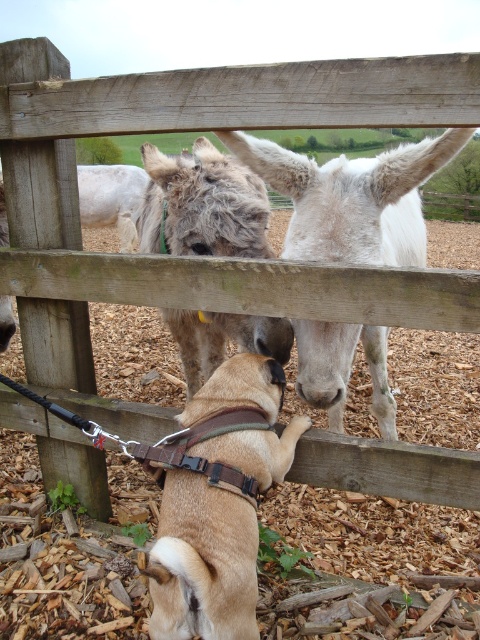
In the scene shown: Is brown leather harness at lower center closer to the viewer compared to fuzzy gray mule at center?

Yes.

Is brown leather harness at lower center to the left of fuzzy gray mule at center from the viewer's perspective?

No, brown leather harness at lower center is not to the left of fuzzy gray mule at center.

Does point (224, 545) lie behind point (172, 232)?

No, (224, 545) is in front of (172, 232).

Where is `brown leather harness at lower center`? The width and height of the screenshot is (480, 640). brown leather harness at lower center is located at coordinates tap(204, 561).

Describe the element at coordinates (204, 561) in the screenshot. I see `brown leather harness at lower center` at that location.

Can you confirm if brown leather harness at lower center is bigger than white matte donkey at center?

Incorrect, brown leather harness at lower center is not larger than white matte donkey at center.

Is point (206, 408) behind point (296, 216)?

That is False.

You are a GUI agent. You are given a task and a screenshot of the screen. Output one action in this format:
    pyautogui.click(x=<x>, y=<y>)
    Task: Click on the brown leather harness at lower center
    
    Given the screenshot: What is the action you would take?
    pyautogui.click(x=204, y=561)

Who is shorter, white matte donkey at center or fuzzy gray mule at center?

With less height is white matte donkey at center.

Is white matte donkey at center to the right of fuzzy gray mule at center from the viewer's perspective?

Correct, you'll find white matte donkey at center to the right of fuzzy gray mule at center.

This screenshot has height=640, width=480. What are the coordinates of `white matte donkey at center` in the screenshot? It's located at (351, 196).